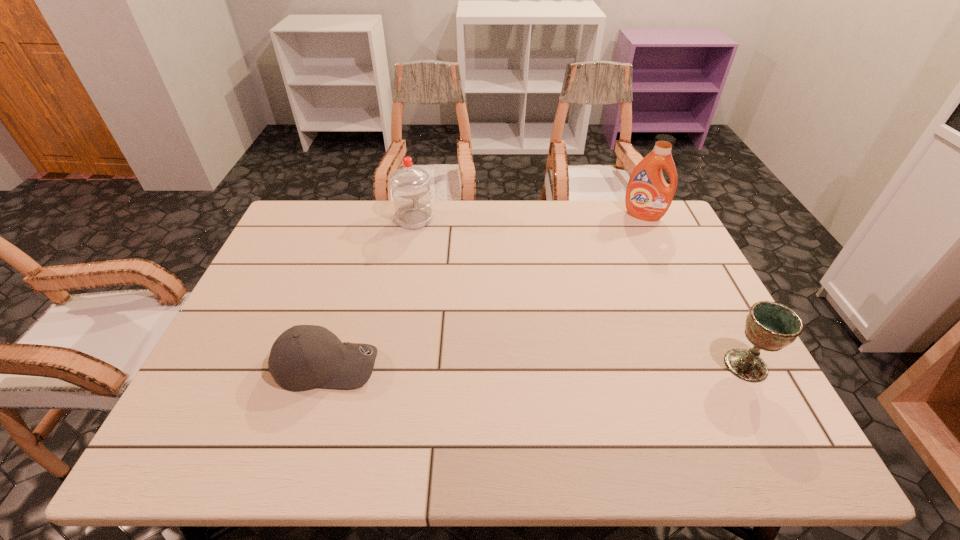
What are the coordinates of `free spot on the desktop that is between the shortest object and the second shortest object and is positioned on the handle side of the third shortest object` in the screenshot? It's located at (484, 365).

At what (x,y) coordinates should I click in order to perform the action: click on vacant space on the desktop that is between the baseball cap and the third tallest object and is positioned on the front-facing side of the tallest object. Please return your answer as a coordinate pair (x, y). Looking at the image, I should click on (588, 365).